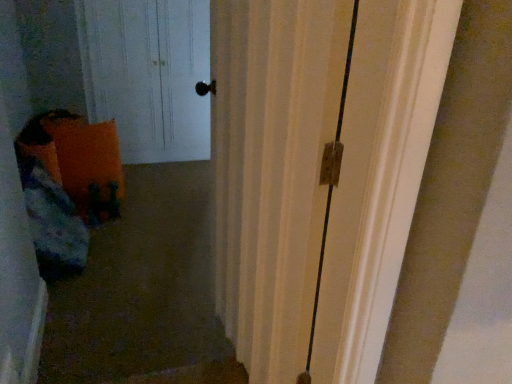
Where is `white wood door at upper left`? white wood door at upper left is located at coordinates (148, 75).

The width and height of the screenshot is (512, 384). What do you see at coordinates (148, 75) in the screenshot?
I see `white wood door at upper left` at bounding box center [148, 75].

Identify the location of white wood door at upper left. (148, 75).